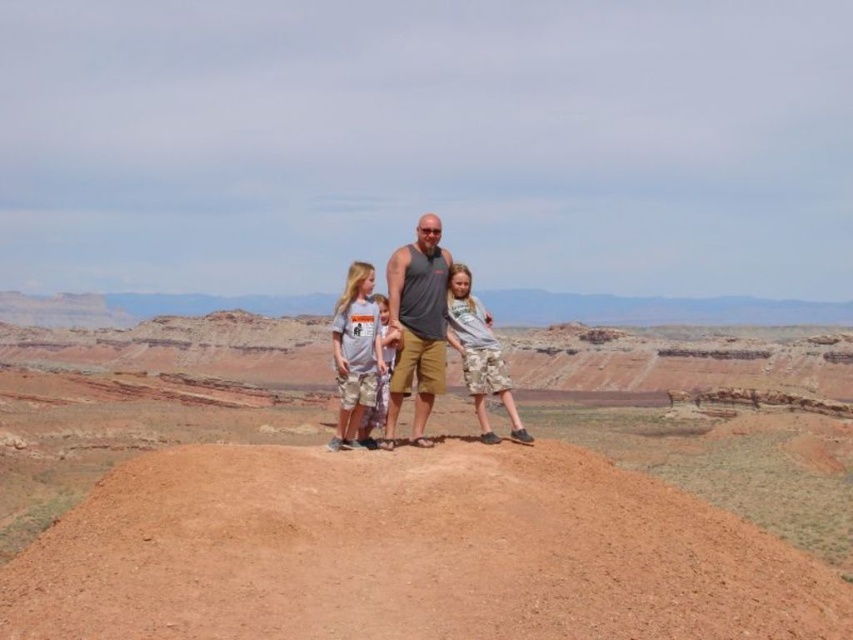
Question: Does gray fabric tank top at center appear under camo shorts at center?

Choices:
 (A) no
 (B) yes

Answer: (B)

Question: Is brown sandy mound at center above camo shorts at center?

Choices:
 (A) no
 (B) yes

Answer: (A)

Question: Which point is closer to the camera?

Choices:
 (A) camouflage shorts at center
 (B) gray fabric tank top at center
 (C) matte gray tank top at center
 (D) camo shorts at center

Answer: (B)

Question: Which object appears closest to the camera in this image?

Choices:
 (A) brown sandy mound at center
 (B) camouflage shorts at center
 (C) gray fabric tank top at center
 (D) matte gray tank top at center

Answer: (A)

Question: Which object appears farthest from the camera in this image?

Choices:
 (A) camo shorts at center
 (B) matte gray tank top at center

Answer: (A)

Question: Is matte gray tank top at center thinner than gray fabric tank top at center?

Choices:
 (A) yes
 (B) no

Answer: (B)